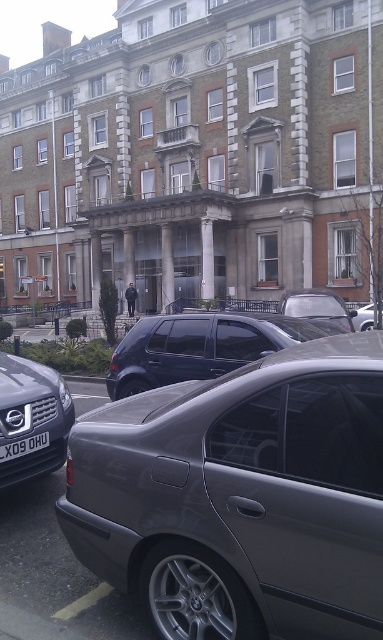
Question: Is metallic gray sedan at center wider than metallic silver car at center?

Choices:
 (A) yes
 (B) no

Answer: (B)

Question: Is metallic gray sedan at center thinner than metallic blue minivan at center?

Choices:
 (A) yes
 (B) no

Answer: (A)

Question: Which object appears farthest from the camera in this image?

Choices:
 (A) black plastic license plate at lower center
 (B) metallic blue minivan at center

Answer: (B)

Question: Which point is farther to the camera?

Choices:
 (A) (368, 326)
 (B) (24, 452)

Answer: (A)

Question: Which point is farther to the camera?

Choices:
 (A) metallic silver car at center
 (B) black plastic license plate at lower center
 (C) matte black car at left

Answer: (A)

Question: Can you confirm if matte black car at left is smaller than silver metallic car at center?

Choices:
 (A) no
 (B) yes

Answer: (A)